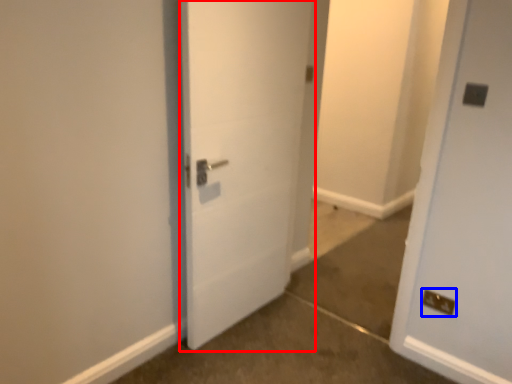
Question: Which point is closer to the camera, door (highlighted by a red box) or electric outlet (highlighted by a blue box)?

Choices:
 (A) door
 (B) electric outlet

Answer: (A)